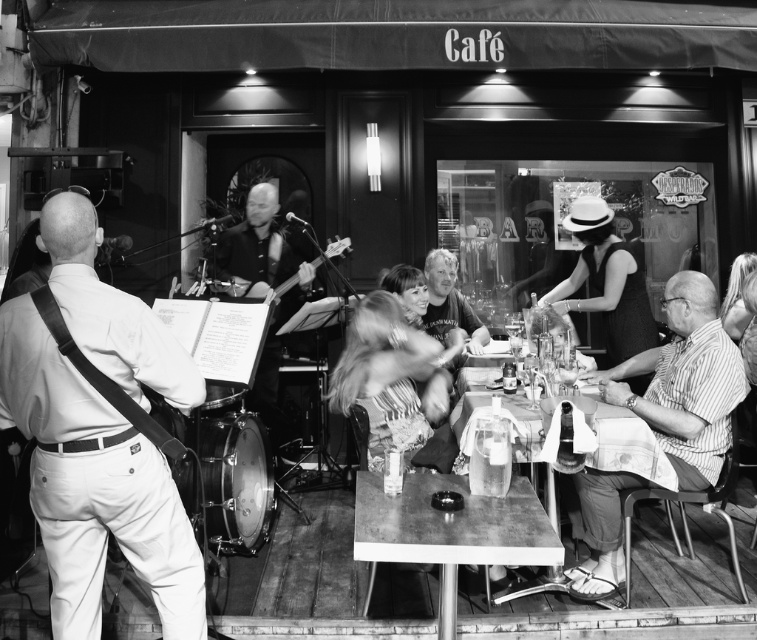
Can you confirm if smooth leather jacket at center is bigger than clear plastic cup at center?

Yes, smooth leather jacket at center is bigger than clear plastic cup at center.

Does point (428, 301) lie behind point (469, 464)?

Yes.

Where is `smooth leather jacket at center`? The image size is (757, 640). smooth leather jacket at center is located at coordinates (449, 301).

Where is `smooth leather jacket at center`? This screenshot has height=640, width=757. smooth leather jacket at center is located at coordinates (449, 301).

Is clear plastic cup at center bigger than wooden acoustic guitar at center?

No, clear plastic cup at center is not bigger than wooden acoustic guitar at center.

Which of these two, clear plastic cup at center or wooden acoustic guitar at center, stands shorter?

With less height is clear plastic cup at center.

The width and height of the screenshot is (757, 640). Describe the element at coordinates (491, 460) in the screenshot. I see `clear plastic cup at center` at that location.

What are the coordinates of `clear plastic cup at center` in the screenshot? It's located at (491, 460).

Who is shorter, white fabric guitar at left or striped cotton shirt at right?

striped cotton shirt at right is shorter.

Between white fabric guitar at left and striped cotton shirt at right, which one is positioned higher?

Positioned higher is white fabric guitar at left.

Is point (142, 305) farther from viewer compared to point (703, 300)?

No, it is in front of (703, 300).

You are a GUI agent. You are given a task and a screenshot of the screen. Output one action in this format:
    pyautogui.click(x=<x>, y=<y>)
    Task: Click on the white fabric guitar at left
    
    Given the screenshot: What is the action you would take?
    pyautogui.click(x=94, y=486)